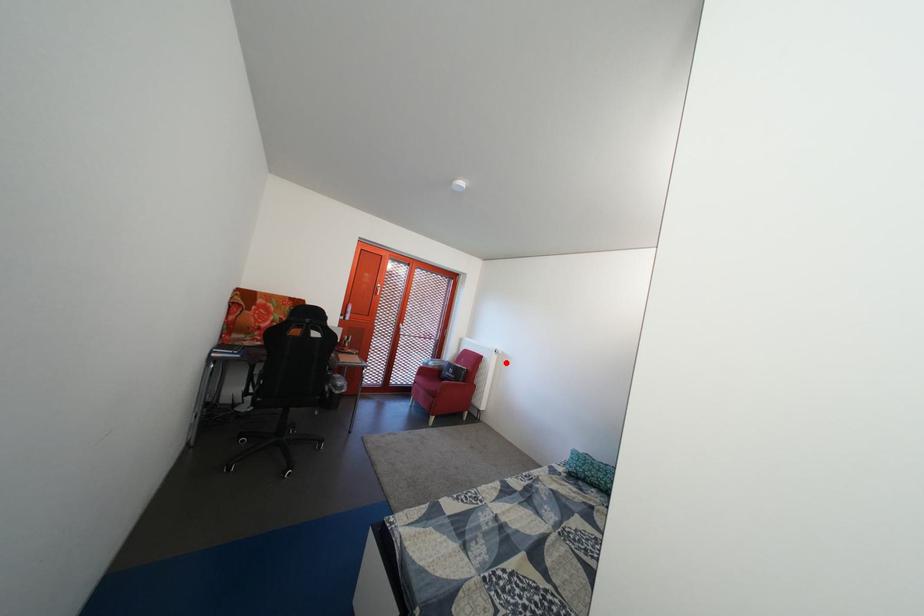
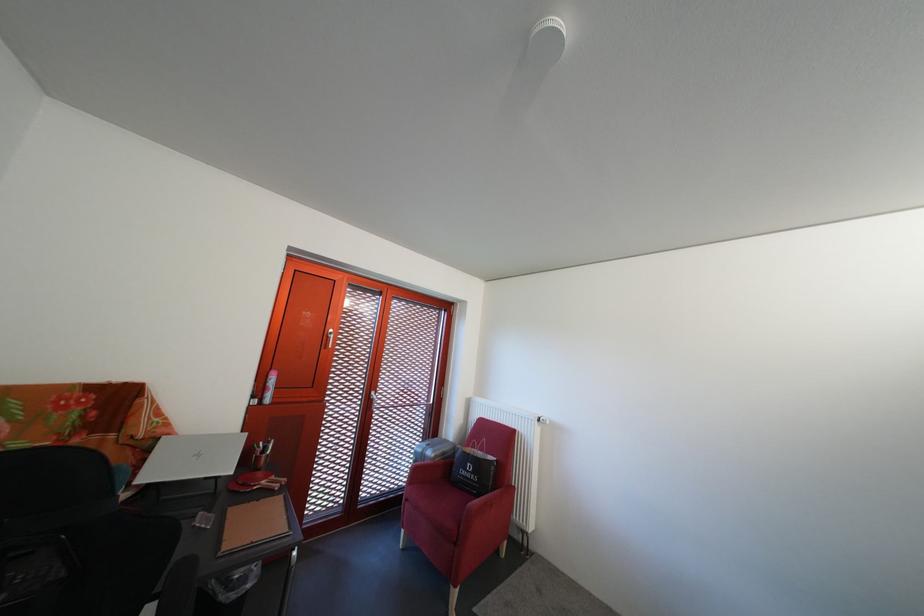
The point at the highlighted location is marked in the first image. Where is the corresponding point in the second image?

(549, 436)